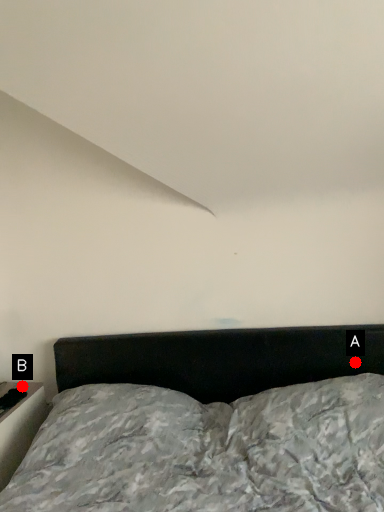
Question: Two points are circled on the image, labeled by A and B beside each circle. Which point is closer to the camera taking this photo?

Choices:
 (A) A is closer
 (B) B is closer

Answer: (A)